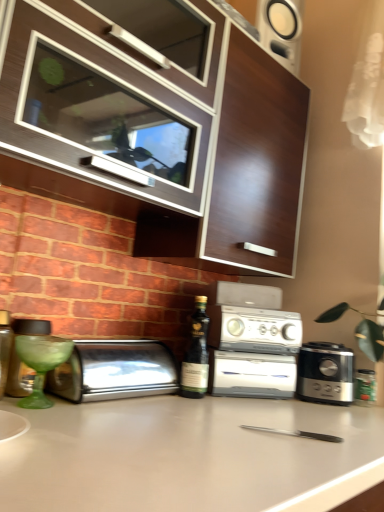
Identify the location of vacant area that lies to the right of matte brown bottle at left, the second bottle from the back. (68, 408).